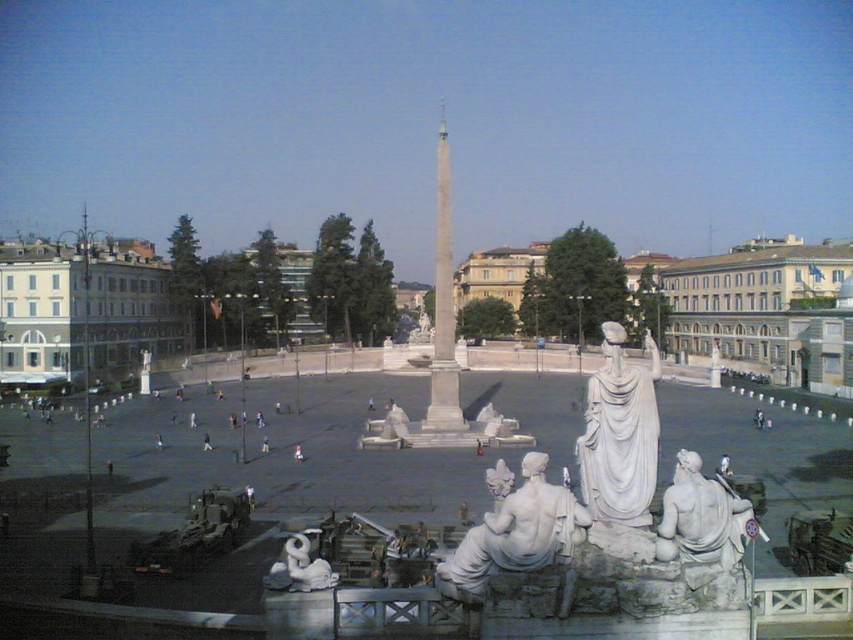
Who is taller, white marble statue at center or white marble statue at lower right?

white marble statue at center

Image resolution: width=853 pixels, height=640 pixels. I want to click on white marble statue at center, so click(x=619, y=435).

Is the position of white marble statues at center more distant than that of white marble statue at lower center?

No, white marble statues at center is in front of white marble statue at lower center.

Is point (254, 435) positioned before point (526, 531)?

No.

The height and width of the screenshot is (640, 853). What are the coordinates of `white marble statues at center` in the screenshot? It's located at (485, 508).

Is white marble statues at center wider than white marble statue at center?

Indeed, white marble statues at center has a greater width compared to white marble statue at center.

Is white marble statues at center bigger than white marble statue at center?

Yes.

This screenshot has width=853, height=640. Identify the location of white marble statues at center. (485, 508).